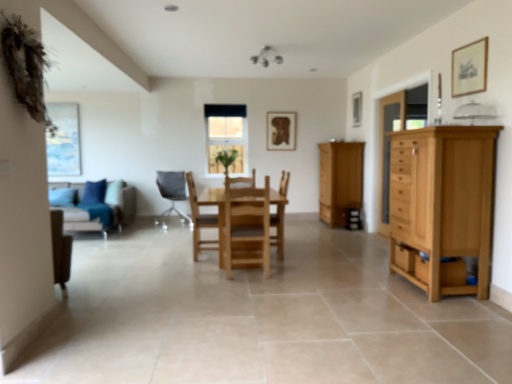
The width and height of the screenshot is (512, 384). What do you see at coordinates (281, 131) in the screenshot?
I see `wooden picture frame at upper center, which is the 1th picture frame in left-to-right order` at bounding box center [281, 131].

What is the approximate height of matte gray chair at center, the 1th chair when ordered from left to right?

It is 37.11 inches.

What do you see at coordinates (469, 68) in the screenshot?
I see `wooden picture frame at upper right, marked as the first picture frame in a front-to-back arrangement` at bounding box center [469, 68].

At what (x,y) coordinates should I click in order to perform the action: click on beige fabric couch at left. Please return your answer as a coordinate pair (x, y). Looking at the image, I should click on (95, 206).

Considering the relative sizes of light brown wood cabinet at center right and wooden picture frame at upper center, marked as the 1th picture frame in a back-to-front arrangement, in the image provided, is light brown wood cabinet at center right taller than wooden picture frame at upper center, marked as the 1th picture frame in a back-to-front arrangement,?

Yes, light brown wood cabinet at center right is taller than wooden picture frame at upper center, marked as the 1th picture frame in a back-to-front arrangement.

Is the depth of light brown wood cabinet at center right greater than that of wooden picture frame at upper center, marked as the 1th picture frame in a back-to-front arrangement?

No, light brown wood cabinet at center right is in front of wooden picture frame at upper center, marked as the 1th picture frame in a back-to-front arrangement.

Between light brown wood cabinet at center right and clear glass cabinet at right, which one has smaller width?

Thinner between the two is clear glass cabinet at right.

Considering the positions of objects light brown wood cabinet at center right and clear glass cabinet at right in the image provided, who is behind, light brown wood cabinet at center right or clear glass cabinet at right?

light brown wood cabinet at center right is more distant.

From their relative heights in the image, would you say light brown wood cabinet at center right is taller or shorter than clear glass cabinet at right?

light brown wood cabinet at center right is shorter than clear glass cabinet at right.

From a real-world perspective, between light brown wood cabinet at center right and clear glass cabinet at right, who is vertically lower?

In real-world perspective, light brown wood cabinet at center right is lower.

Are light brown wooden cupboard at right and wooden picture frame at upper center, marked as the 1th picture frame in a back-to-front arrangement, far apart?

Absolutely, light brown wooden cupboard at right is distant from wooden picture frame at upper center, marked as the 1th picture frame in a back-to-front arrangement.

From a real-world perspective, is light brown wooden cupboard at right over wooden picture frame at upper center, which is the 1th picture frame in left-to-right order?

No, from a real-world perspective, light brown wooden cupboard at right is not above wooden picture frame at upper center, which is the 1th picture frame in left-to-right order.

In terms of width, does light brown wooden cupboard at right look wider or thinner when compared to wooden picture frame at upper center, which is the 1th picture frame in left-to-right order?

Clearly, light brown wooden cupboard at right has more width compared to wooden picture frame at upper center, which is the 1th picture frame in left-to-right order.

Considering the positions of points (465, 231) and (266, 116), is point (465, 231) farther from camera compared to point (266, 116)?

No, it is in front of (266, 116).

Is there a large distance between wooden picture frame at upper center, which is the second picture frame from left to right, and clear glass cabinet at right?

Absolutely, wooden picture frame at upper center, which is the second picture frame from left to right, is distant from clear glass cabinet at right.

Looking at this image, could you tell me if wooden picture frame at upper center, positioned as the 2th picture frame in right-to-left order, is facing clear glass cabinet at right?

No, wooden picture frame at upper center, positioned as the 2th picture frame in right-to-left order, is not aimed at clear glass cabinet at right.

This screenshot has height=384, width=512. Find the location of `glass door in front of the wooden picture frame at upper center, which is the second picture frame from left to right`. glass door in front of the wooden picture frame at upper center, which is the second picture frame from left to right is located at coordinates (388, 150).

Do you think clear glass window at center is within natural wood chair at center, the first chair from the right, or outside of it?

The correct answer is: outside.

From a real-world perspective, is clear glass window at center beneath natural wood chair at center, which appears as the third chair when viewed from the back?

No, from a real-world perspective, clear glass window at center is not under natural wood chair at center, which appears as the third chair when viewed from the back.

How different are the orientations of clear glass window at center and natural wood chair at center, the first chair from the right, in degrees?

The angular difference between clear glass window at center and natural wood chair at center, the first chair from the right, is 178 degrees.

Does clear glass window at center turn towards natural wood chair at center, which appears as the third chair when viewed from the back?

Yes, clear glass window at center is aimed at natural wood chair at center, which appears as the third chair when viewed from the back.

Is light brown wood cabinet at center right shorter than wooden drawer at right?

Incorrect, the height of light brown wood cabinet at center right does not fall short of that of wooden drawer at right.

Is light brown wood cabinet at center right not near wooden drawer at right?

Yes.

Between light brown wooden cupboard at right and light brown wooden table at center, which one appears on the right side from the viewer's perspective?

Positioned to the right is light brown wooden cupboard at right.

Considering the sizes of light brown wooden cupboard at right and light brown wooden table at center in the image, is light brown wooden cupboard at right taller or shorter than light brown wooden table at center?

light brown wooden cupboard at right is taller than light brown wooden table at center.

From the picture: Can you tell me how much light brown wooden cupboard at right and light brown wooden table at center differ in facing direction?

The angle between the facing direction of light brown wooden cupboard at right and the facing direction of light brown wooden table at center is 0.881 degrees.

Is light brown wooden cupboard at right oriented towards light brown wooden table at center?

No, light brown wooden cupboard at right is not aimed at light brown wooden table at center.

Image resolution: width=512 pixels, height=384 pixels. In order to click on cabinetry lying in front of the wooden picture frame at upper center, marked as the 1th picture frame in a back-to-front arrangement in this screenshot , I will do `click(340, 180)`.

This screenshot has height=384, width=512. Identify the location of glass door above the light brown wood cabinet at center right (from a real-world perspective). (388, 150).

From the image, which object appears to be farther from wooden picture frame at upper center, the second picture frame from the back, wooden chair at center, positioned as the 2th chair in left-to-right order, or beige fabric couch at left?

The object further to wooden picture frame at upper center, the second picture frame from the back, is beige fabric couch at left.

Looking at the image, which one is located further to light brown wooden table at center, natural wood chair at center, the third chair when ordered from left to right, or wooden picture frame at upper right, arranged as the first picture frame when viewed from the right?

Among the two, wooden picture frame at upper right, arranged as the first picture frame when viewed from the right, is located further to light brown wooden table at center.

Estimate the real-world distances between objects in this image. Which object is closer to beige fabric couch at left, wooden picture frame at upper center, positioned as the 2th picture frame in right-to-left order, or matte gray chair at center, the 1th chair when ordered from left to right?

matte gray chair at center, the 1th chair when ordered from left to right.

Considering their positions, is wooden drawer at right positioned further to light brown wooden table at center than wooden picture frame at upper right, the 3th picture frame when ordered from back to front?

Among the two, wooden picture frame at upper right, the 3th picture frame when ordered from back to front, is located further to light brown wooden table at center.

Considering their positions, is wooden picture frame at upper right, arranged as the third picture frame when viewed from the left, positioned closer to wooden chair at center, positioned as the 2th chair in left-to-right order, than wooden picture frame at upper center, the second picture frame viewed from the front?

The object closer to wooden chair at center, positioned as the 2th chair in left-to-right order, is wooden picture frame at upper right, arranged as the third picture frame when viewed from the left.

Based on their spatial positions, is matte gray chair at center, the 1th chair when ordered from left to right, or clear glass window at center further from natural wood chair at center, arranged as the first chair when viewed from the front?

The object further to natural wood chair at center, arranged as the first chair when viewed from the front, is clear glass window at center.

Which object lies further to the anchor point clear glass cabinet at right, beige fabric couch at left or wooden picture frame at upper center, the second picture frame from the back?

The object further to clear glass cabinet at right is beige fabric couch at left.

When comparing their distances from clear glass cabinet at right, does green leafy plant at center or light brown wooden table at center seem closer?

green leafy plant at center.

Find the location of a particular element. The height and width of the screenshot is (384, 512). glass door located between wooden picture frame at upper right, the 3th picture frame when ordered from back to front, and light brown wood cabinet at center right in the depth direction is located at coordinates (388, 150).

Identify the location of picture frame positioned between wooden picture frame at upper right, the 3th picture frame when ordered from back to front, and wooden picture frame at upper center, which is the 3th picture frame from right to left, from near to far. The width and height of the screenshot is (512, 384). (357, 109).

Identify the location of studio couch between light brown wooden cupboard at right and clear glass window at center in the front-back direction. (95, 206).

The width and height of the screenshot is (512, 384). What are the coordinates of `chair between wooden chair at center, the 2th chair in the right-to-left sequence, and clear glass cabinet at right, in the horizontal direction` in the screenshot? It's located at (246, 228).